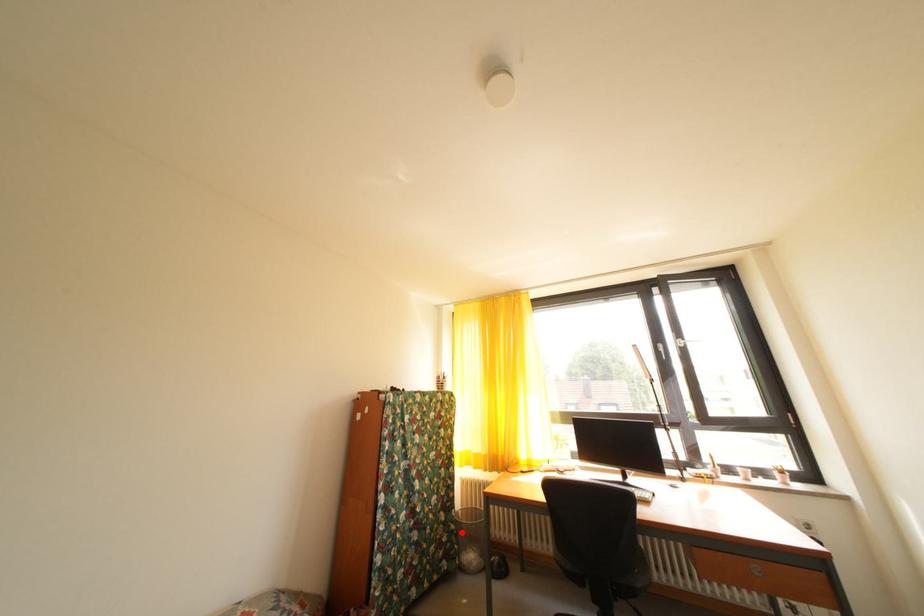
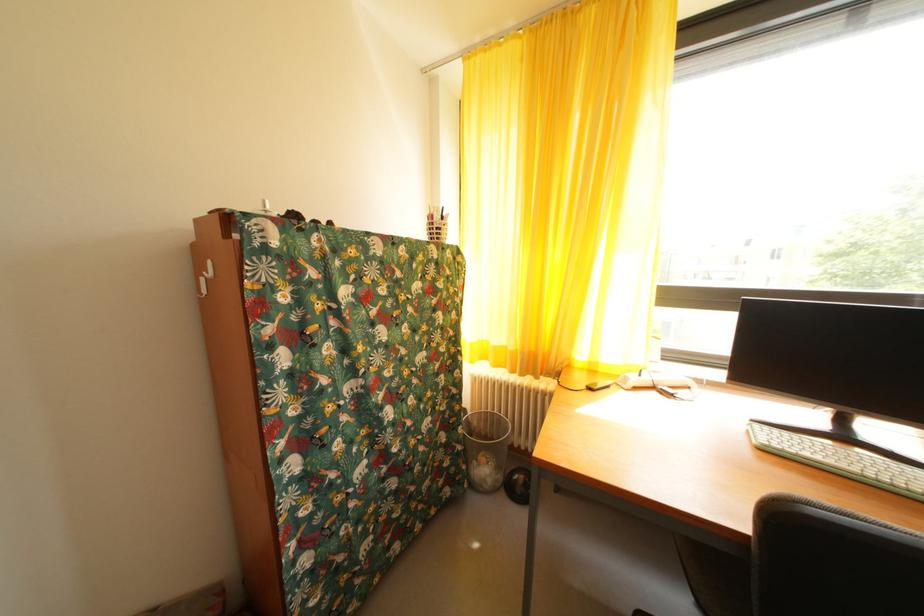
The point at the highlighted location is marked in the first image. Where is the corresponding point in the second image?

(468, 454)